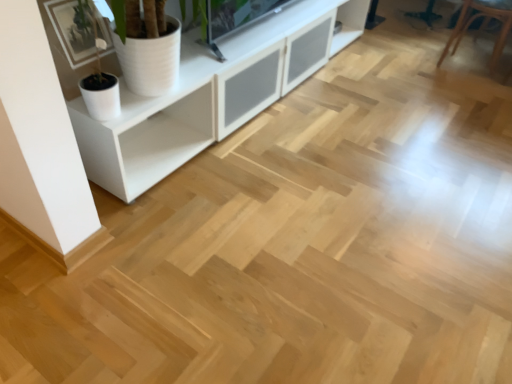
In order to click on vacant space underneath brown leather armchair at upper right (from a real-world perspective) in this screenshot , I will do `click(470, 62)`.